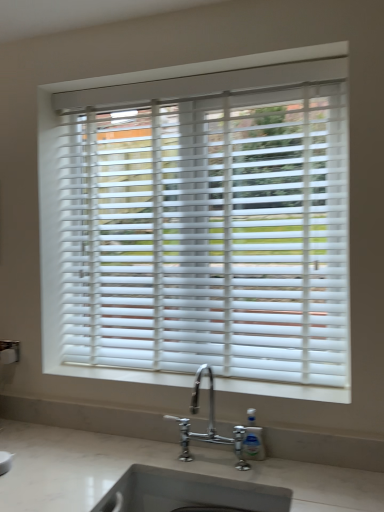
In order to click on free location in front of clear plastic soap dispenser at lower center in this screenshot , I will do `click(268, 478)`.